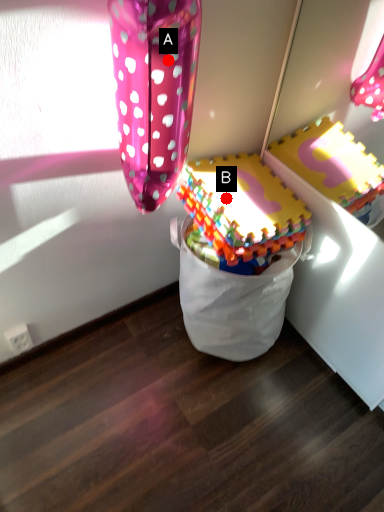
Question: Two points are circled on the image, labeled by A and B beside each circle. Which point appears closest to the camera in this image?

Choices:
 (A) A is closer
 (B) B is closer

Answer: (A)